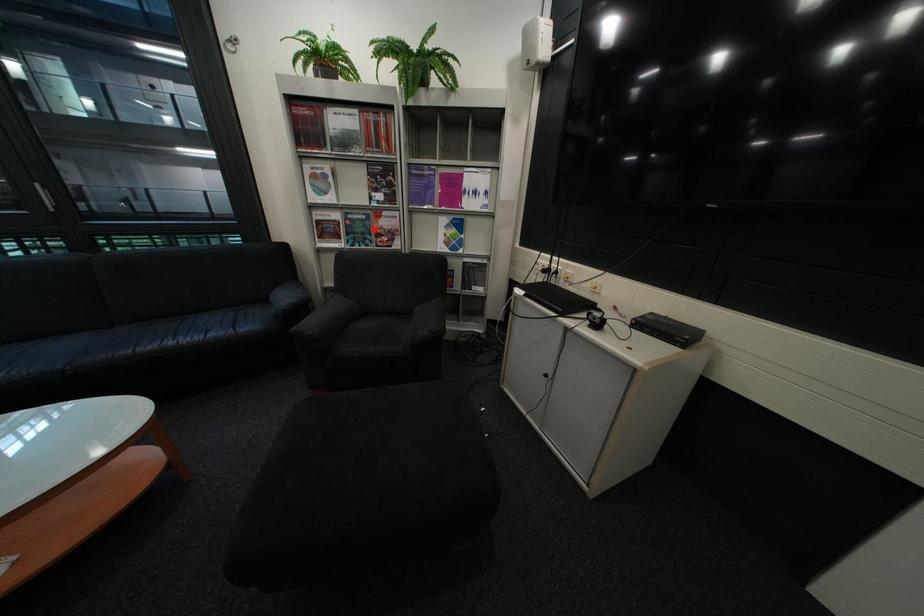
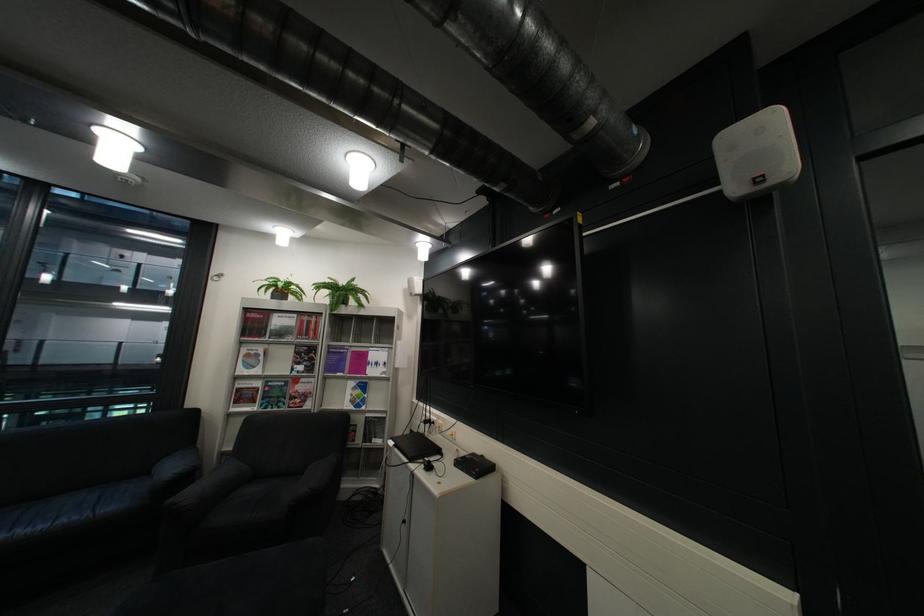
The point at the highlighted location is marked in the first image. Where is the corresponding point in the second image?

(290, 394)